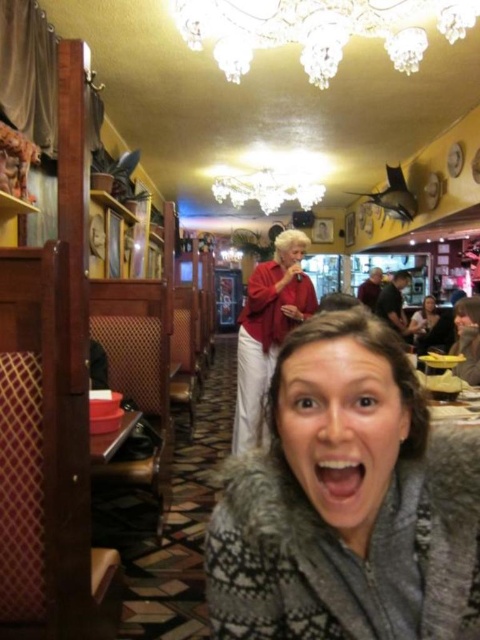
Does crystal chandelier at upper center appear under matte black jacket at lower right?

Incorrect, crystal chandelier at upper center is not positioned below matte black jacket at lower right.

Who is positioned more to the right, crystal chandelier at upper center or matte black jacket at lower right?

Positioned to the right is matte black jacket at lower right.

Which is in front, point (199, 45) or point (434, 339)?

Point (199, 45) is in front.

You are a GUI agent. You are given a task and a screenshot of the screen. Output one action in this format:
    pyautogui.click(x=<x>, y=<y>)
    Task: Click on the crystal chandelier at upper center
    This screenshot has height=640, width=480.
    Given the screenshot: What is the action you would take?
    pyautogui.click(x=317, y=29)

Is point (287, 332) positioned in front of point (420, 340)?

Yes, point (287, 332) is in front of point (420, 340).

Who is lower down, matte red blouse at center or matte black jacket at lower right?

matte red blouse at center is below.

Does point (280, 250) come closer to viewer compared to point (415, 333)?

Yes, it is in front of point (415, 333).

This screenshot has width=480, height=640. I want to click on matte red blouse at center, so click(267, 326).

Between crystal chandelier at upper center and shiny crystal chandelier at upper center, which one appears on the right side from the viewer's perspective?

crystal chandelier at upper center

Which is behind, point (265, 0) or point (282, 202)?

The point (282, 202) is behind.

Where is `crystal chandelier at upper center`? crystal chandelier at upper center is located at coordinates (317, 29).